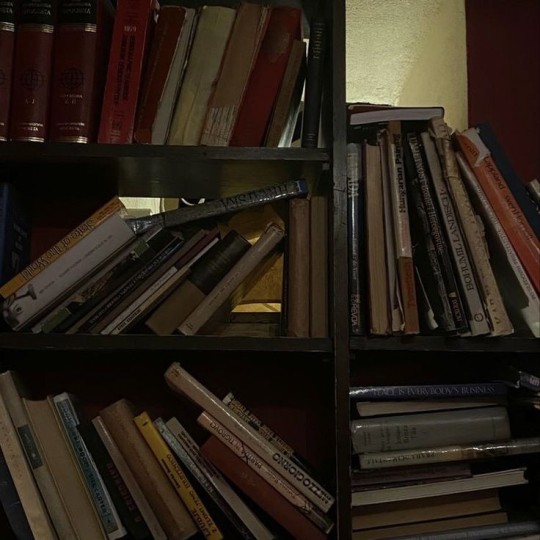
What are the coordinates of `front of books` in the screenshot? It's located at (172, 85), (68, 480), (417, 111), (453, 484), (367, 411).